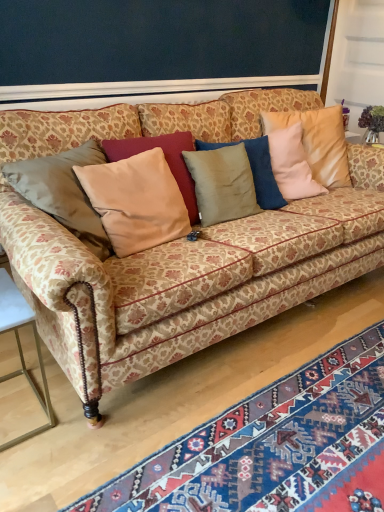
Question: Is the position of satin beige pillow at center, arranged as the 1th pillow when viewed from the right, less distant than that of blue woven rug at lower right?

Choices:
 (A) yes
 (B) no

Answer: (B)

Question: Can you confirm if satin beige pillow at center, arranged as the 1th pillow when viewed from the right, is wider than blue woven rug at lower right?

Choices:
 (A) yes
 (B) no

Answer: (B)

Question: Could you tell me if satin beige pillow at center, which is the second pillow in left-to-right order, is turned towards blue woven rug at lower right?

Choices:
 (A) yes
 (B) no

Answer: (B)

Question: Does satin beige pillow at center, arranged as the 1th pillow when viewed from the right, lie behind blue woven rug at lower right?

Choices:
 (A) yes
 (B) no

Answer: (A)

Question: From a real-world perspective, is satin beige pillow at center, which is the second pillow in left-to-right order, over blue woven rug at lower right?

Choices:
 (A) yes
 (B) no

Answer: (A)

Question: Is satin beige pillow at center, arranged as the 1th pillow when viewed from the right, to the right of blue woven rug at lower right from the viewer's perspective?

Choices:
 (A) yes
 (B) no

Answer: (A)

Question: Can you confirm if beige velvet pillow at center, which ranks as the 1th pillow in left-to-right order, is shorter than satin beige pillow at center, which is the second pillow in left-to-right order?

Choices:
 (A) yes
 (B) no

Answer: (A)

Question: From the image's perspective, is beige velvet pillow at center, which ranks as the 1th pillow in left-to-right order, located beneath satin beige pillow at center, arranged as the 1th pillow when viewed from the right?

Choices:
 (A) no
 (B) yes

Answer: (B)

Question: From the image's perspective, would you say beige velvet pillow at center, placed as the second pillow when sorted from right to left, is positioned over satin beige pillow at center, which is the second pillow in left-to-right order?

Choices:
 (A) yes
 (B) no

Answer: (B)

Question: Would you say beige velvet pillow at center, which ranks as the 1th pillow in left-to-right order, contains satin beige pillow at center, which is the second pillow in left-to-right order?

Choices:
 (A) no
 (B) yes

Answer: (A)

Question: Is beige velvet pillow at center, which ranks as the 1th pillow in left-to-right order, turned away from satin beige pillow at center, which is the second pillow in left-to-right order?

Choices:
 (A) yes
 (B) no

Answer: (B)

Question: Considering the relative sizes of beige velvet pillow at center, which ranks as the 1th pillow in left-to-right order, and satin beige pillow at center, arranged as the 1th pillow when viewed from the right, in the image provided, is beige velvet pillow at center, which ranks as the 1th pillow in left-to-right order, smaller than satin beige pillow at center, arranged as the 1th pillow when viewed from the right,?

Choices:
 (A) no
 (B) yes

Answer: (B)

Question: Considering the relative sizes of satin beige pillow at center, arranged as the 1th pillow when viewed from the right, and patterned fabric couch at center in the image provided, is satin beige pillow at center, arranged as the 1th pillow when viewed from the right, shorter than patterned fabric couch at center?

Choices:
 (A) yes
 (B) no

Answer: (A)